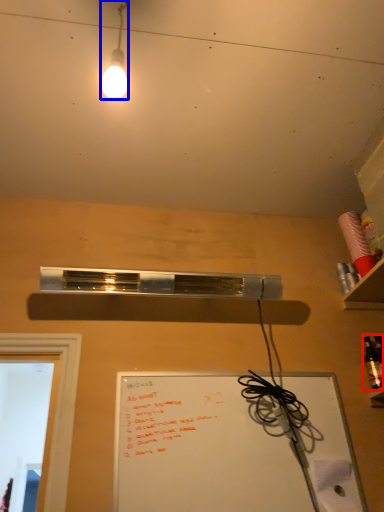
Question: Which object is further to the camera taking this photo, bottle (highlighted by a red box) or lamp (highlighted by a blue box)?

Choices:
 (A) bottle
 (B) lamp

Answer: (A)